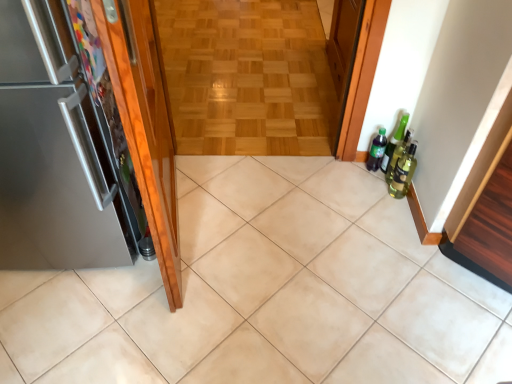
What are the coordinates of `unoccupied area in front of satin metallic refrigerator at left, which is the 2th door in right-to-left order` in the screenshot? It's located at (75, 324).